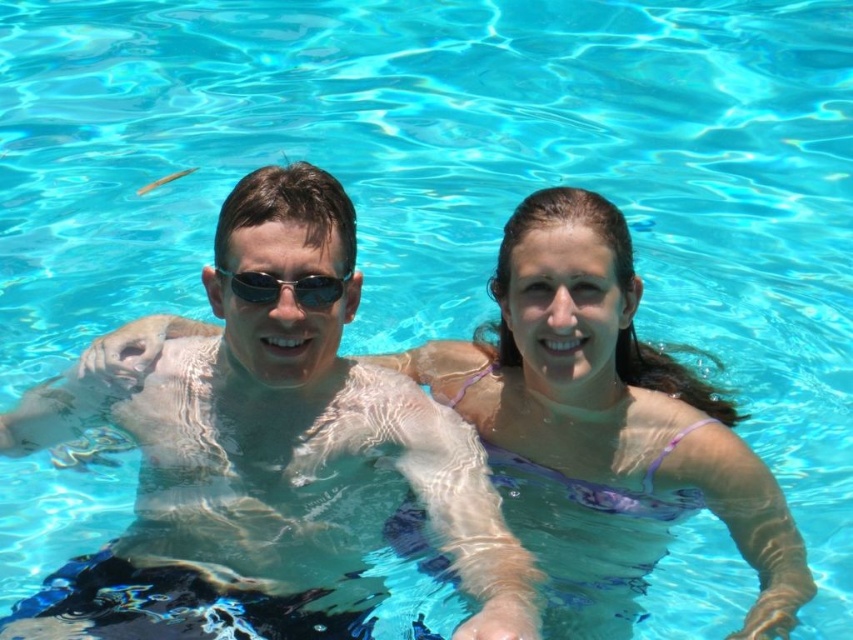
You are standing at the edge of the pool and want to toss a beach ball to the purple fabric bikini top at upper right. If the ball travels in a straight line, how far will it have to go to reach the bikini top?

The purple fabric bikini top at upper right is 12.17 feet away from the viewer, so the beach ball will need to travel 12.17 feet to reach it.

You are a photographer trying to capture the purple fabric bikini top at upper right without the glossy skin at center blocking it. What should you do?

Move the camera angle so that the glossy skin at center is no longer in front of the purple fabric bikini top at upper right.